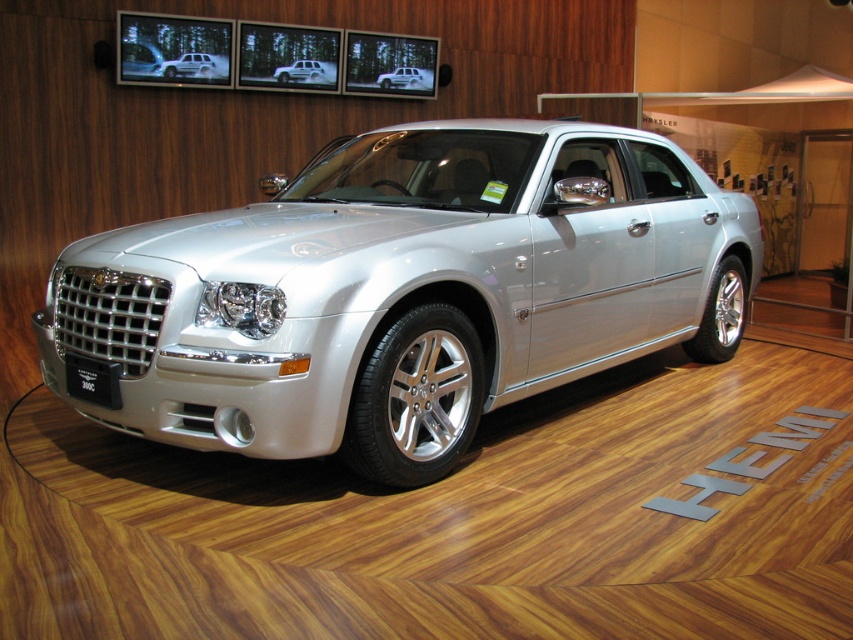
Consider the image. You are an auto show attendee and want to know which car is narrower between the satin silver car at center and the silver metallic sedan at center. Which one is narrower?

The satin silver car at center is narrower than the silver metallic sedan at center.

You are an auto show attendee standing in front of the satin silver metallic sedan at upper center and the silver metallic sedan at center. Which car is taller?

The satin silver metallic sedan at upper center is taller than the silver metallic sedan at center.